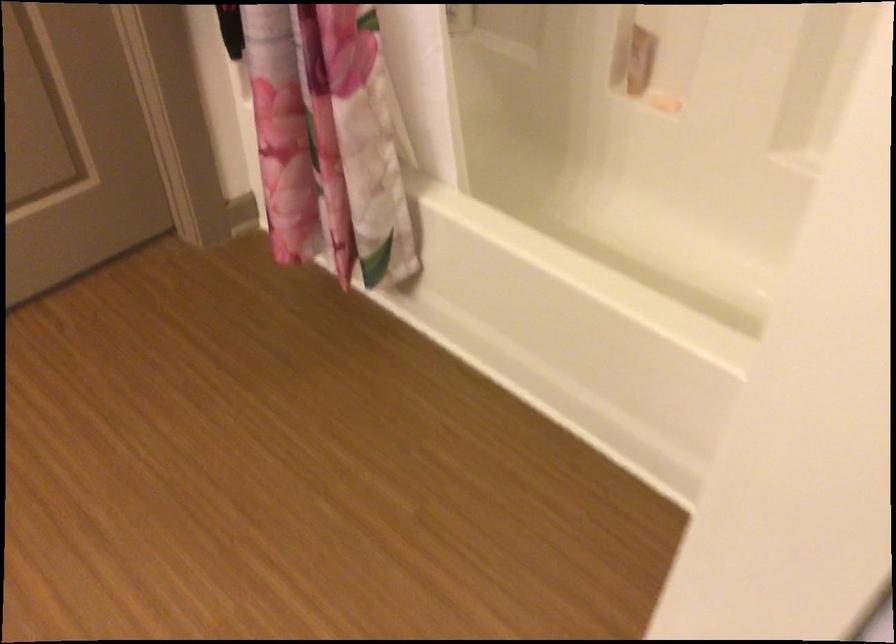
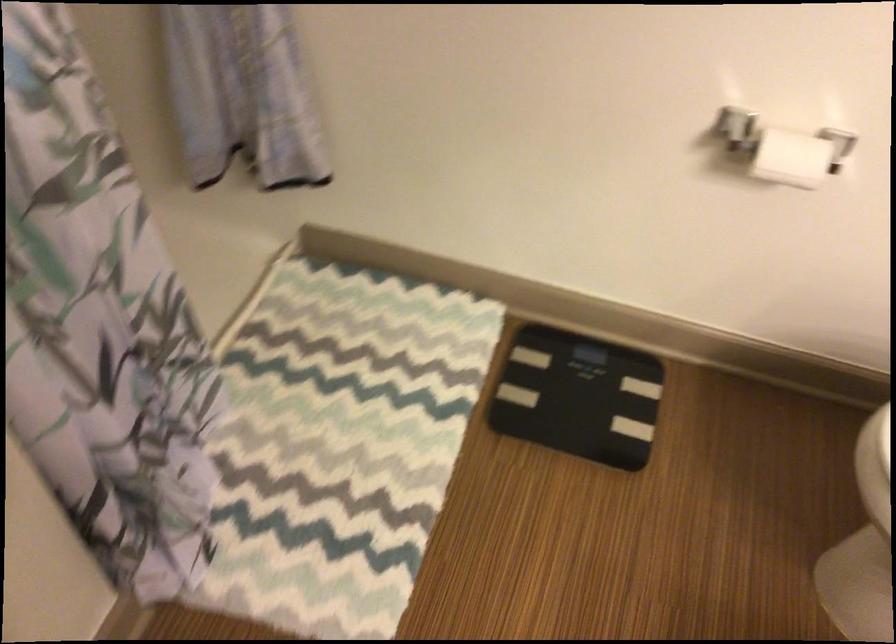
The first image is from the beginning of the video and the second image is from the end. How did the camera likely rotate when shooting the video?

The camera's rotation is toward right-down.